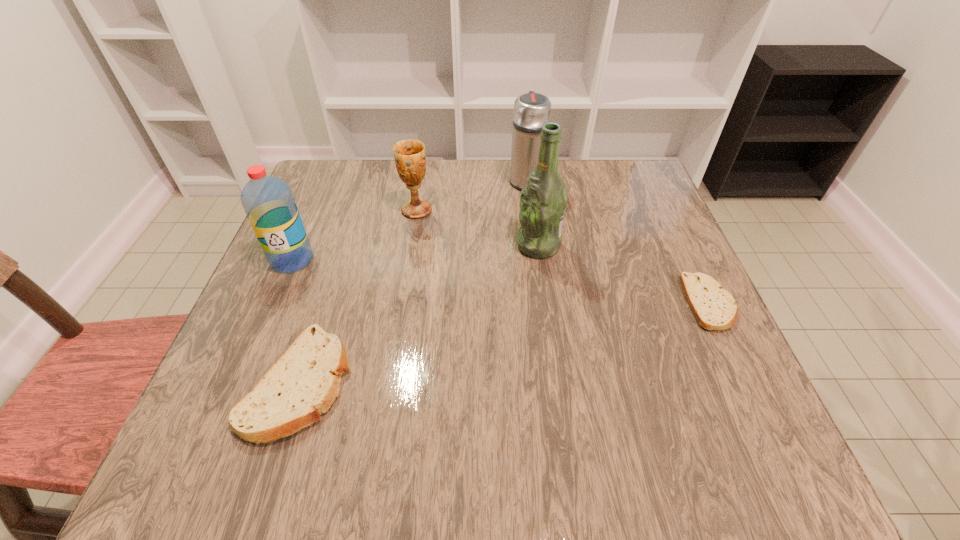
Identify the location of the fifth tallest object. (304, 382).

Where is `the left pita bread`? the left pita bread is located at coordinates (304, 382).

Locate an element on the screen. The image size is (960, 540). the right pita bread is located at coordinates (714, 308).

The width and height of the screenshot is (960, 540). In order to click on the rightmost object in this screenshot , I will do `click(714, 308)`.

You are a GUI agent. You are given a task and a screenshot of the screen. Output one action in this format:
    pyautogui.click(x=<x>, y=<y>)
    Task: Click on the thermos bottle
    
    Given the screenshot: What is the action you would take?
    pyautogui.click(x=532, y=110)

The width and height of the screenshot is (960, 540). I want to click on the second farthest object, so click(x=410, y=159).

Where is `the fourth object from right to left`? This screenshot has height=540, width=960. the fourth object from right to left is located at coordinates (410, 159).

Identify the location of the tallest object. (543, 201).

The height and width of the screenshot is (540, 960). I want to click on water bottle, so click(x=268, y=202).

Where is `vacant region located 0.220m on the back of the left pita bread`? vacant region located 0.220m on the back of the left pita bread is located at coordinates (341, 253).